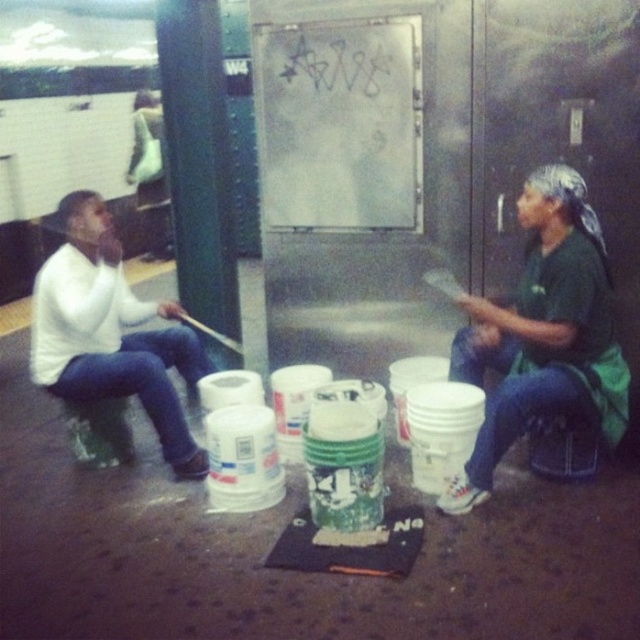
Does green fabric shirt at right have a lesser height compared to white matte sweater at left?

Incorrect, green fabric shirt at right's height does not fall short of white matte sweater at left's.

Does green fabric shirt at right have a greater width compared to white matte sweater at left?

Yes, green fabric shirt at right is wider than white matte sweater at left.

At what (x,y) coordinates should I click in order to perform the action: click on green fabric shirt at right. Please return your answer as a coordinate pair (x, y). The image size is (640, 640). Looking at the image, I should click on (541, 333).

I want to click on green fabric shirt at right, so click(x=541, y=333).